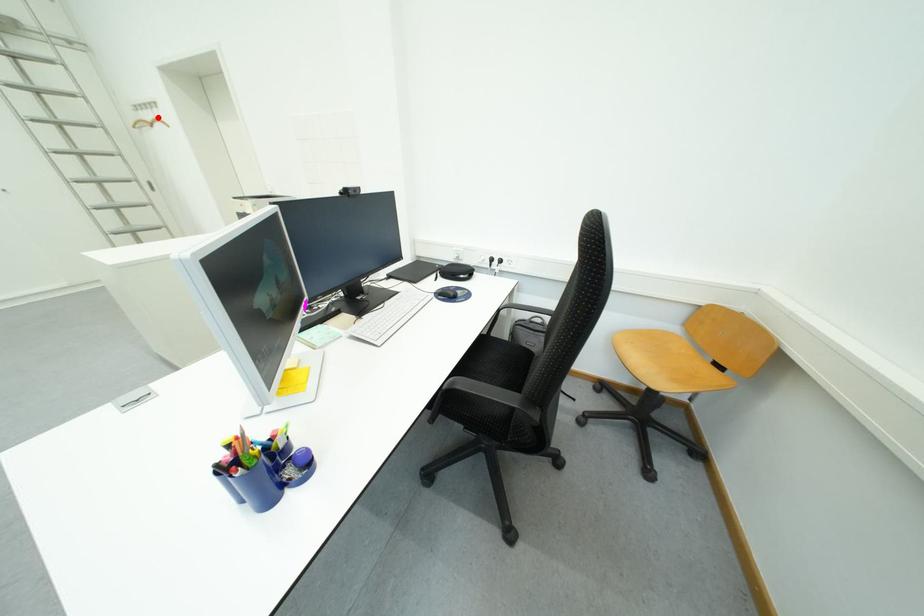
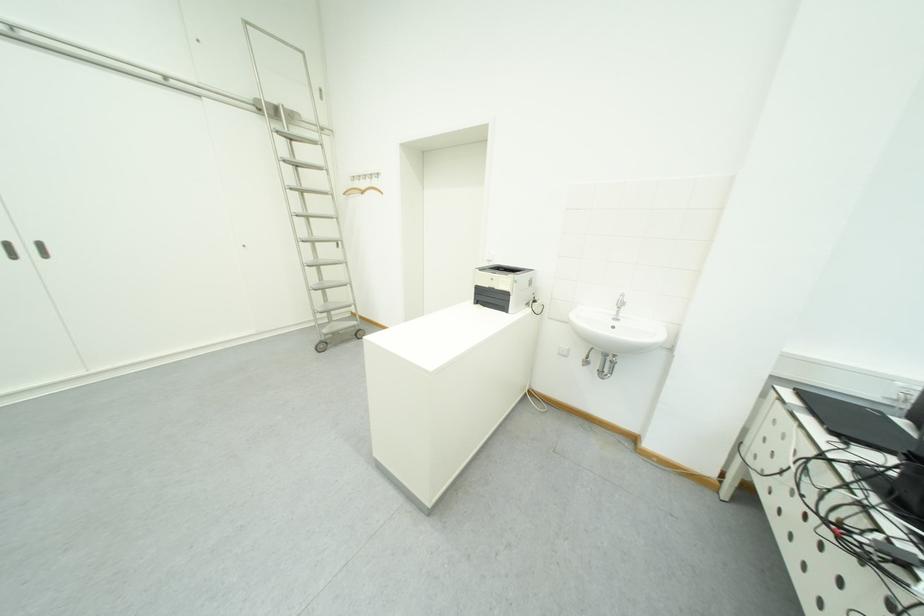
Question: A red point is marked in image1. In image2, is the corresponding 3D point closer to the camera or farther? Reply with the corresponding letter.

Choices:
 (A) The corresponding 3D point is closer.
 (B) The corresponding 3D point is farther.

Answer: (A)